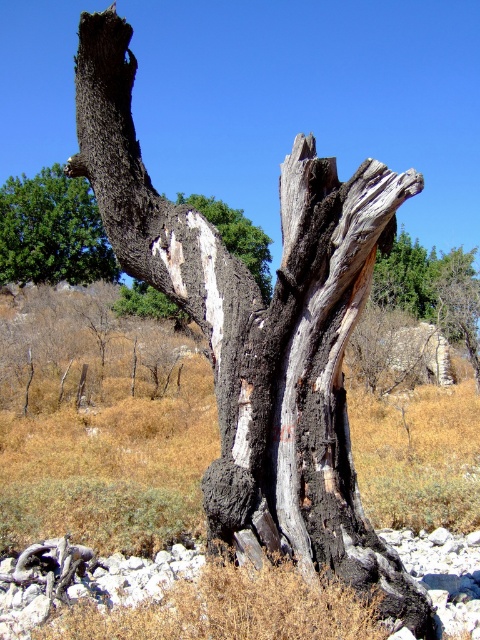
Question: Does green leafy tree at upper left appear on the left side of white textured bark at center?

Choices:
 (A) no
 (B) yes

Answer: (B)

Question: Where is green leafy tree at upper left located in relation to white textured bark at center in the image?

Choices:
 (A) left
 (B) right

Answer: (A)

Question: Does green leafy tree at upper left lie in front of white textured bark at center?

Choices:
 (A) yes
 (B) no

Answer: (B)